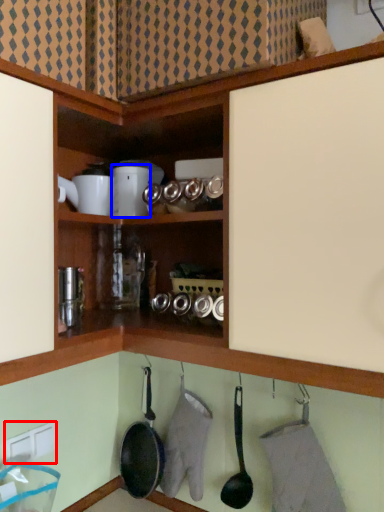
Question: Among these objects, which one is farthest to the camera, electric outlet (highlighted by a red box) or appliance (highlighted by a blue box)?

Choices:
 (A) electric outlet
 (B) appliance

Answer: (B)